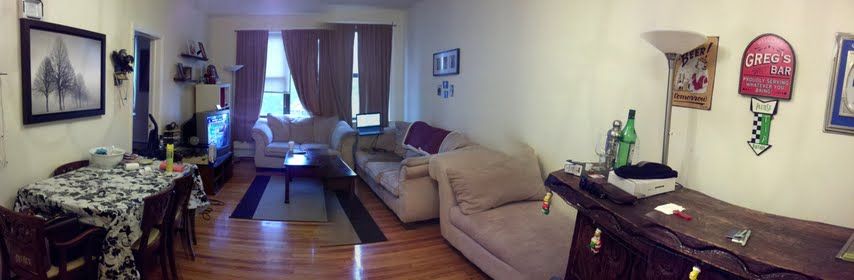
Find the location of a particular element. The height and width of the screenshot is (280, 854). television is located at coordinates (221, 126).